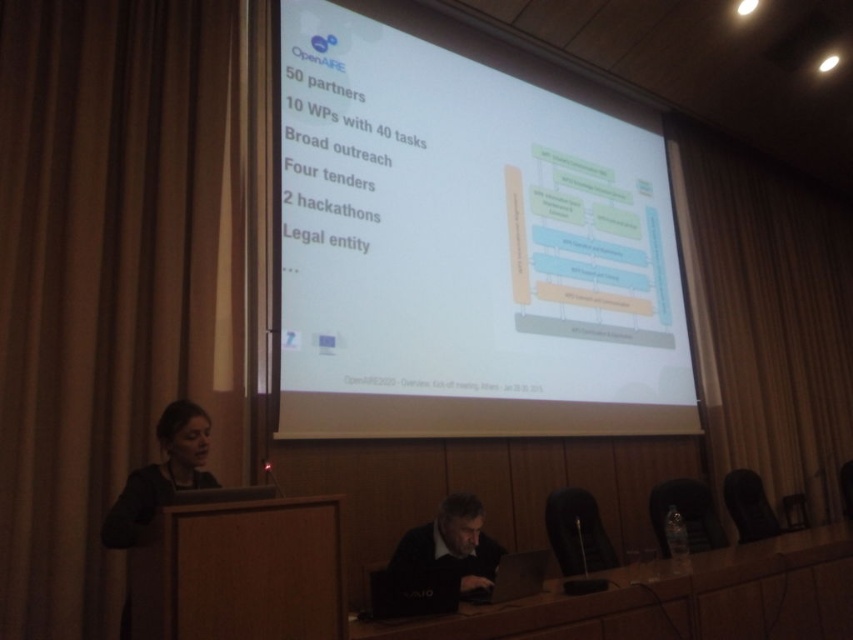
Who is more forward, (173, 470) or (473, 566)?

Point (173, 470) is in front.

I want to click on black fabric at lower left, so click(x=161, y=474).

Which of these two, beige fabric curtain at right or dark brown leather jacket at lower center, stands taller?

Standing taller between the two is beige fabric curtain at right.

Is beige fabric curtain at right shorter than dark brown leather jacket at lower center?

Incorrect, beige fabric curtain at right's height does not fall short of dark brown leather jacket at lower center's.

Image resolution: width=853 pixels, height=640 pixels. Describe the element at coordinates (766, 316) in the screenshot. I see `beige fabric curtain at right` at that location.

Identify the location of beige fabric curtain at right. pyautogui.click(x=766, y=316).

Does white matte projector screen at center have a greater width compared to beige fabric curtain at right?

Indeed, white matte projector screen at center has a greater width compared to beige fabric curtain at right.

Is point (491, 134) positioned behind point (793, 250)?

No, (491, 134) is closer to viewer.

In order to click on white matte projector screen at center in this screenshot , I will do `click(466, 240)`.